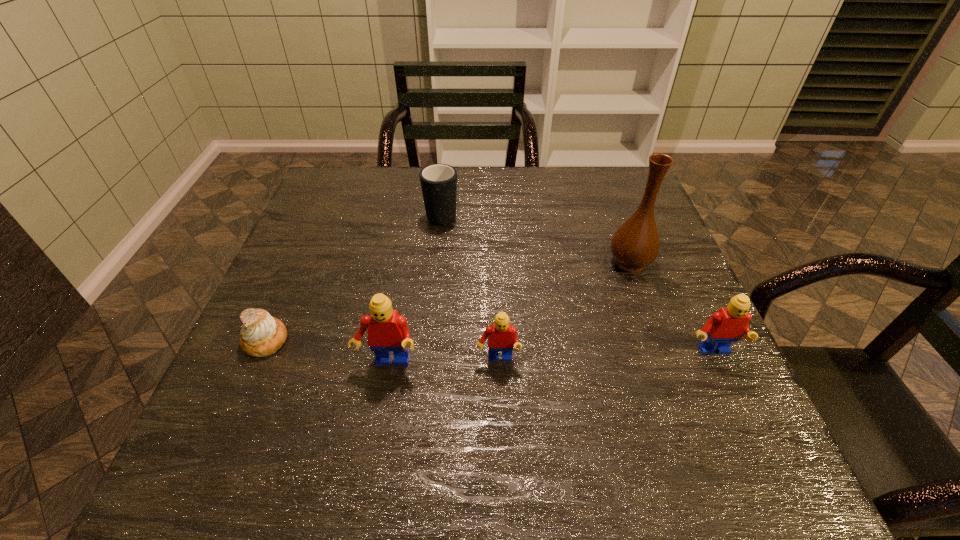
Image resolution: width=960 pixels, height=540 pixels. Find the location of `vacant region located on the front-facing side of the rightmost Lego`. vacant region located on the front-facing side of the rightmost Lego is located at coordinates (740, 415).

Locate an element on the screen. free space located on the side of the mug with the handle is located at coordinates (444, 185).

This screenshot has height=540, width=960. I want to click on vacant space located 0.180m on the side of the mug with the handle, so click(x=446, y=166).

Where is `vacant space located on the side of the mug with the handle`? The height and width of the screenshot is (540, 960). vacant space located on the side of the mug with the handle is located at coordinates (446, 168).

Image resolution: width=960 pixels, height=540 pixels. Find the location of `free spot located on the back of the second farthest object`. free spot located on the back of the second farthest object is located at coordinates (602, 185).

Locate an element on the screen. This screenshot has width=960, height=540. vacant region located on the front of the shortest object is located at coordinates (248, 381).

Locate an element on the screen. The width and height of the screenshot is (960, 540). object present at the far edge is located at coordinates (438, 182).

Identify the location of object that is positioned at the left edge. This screenshot has width=960, height=540. (262, 335).

Identify the location of Lego located at the right edge. (729, 324).

Locate an element on the screen. The height and width of the screenshot is (540, 960). vase present at the right edge is located at coordinates (635, 245).